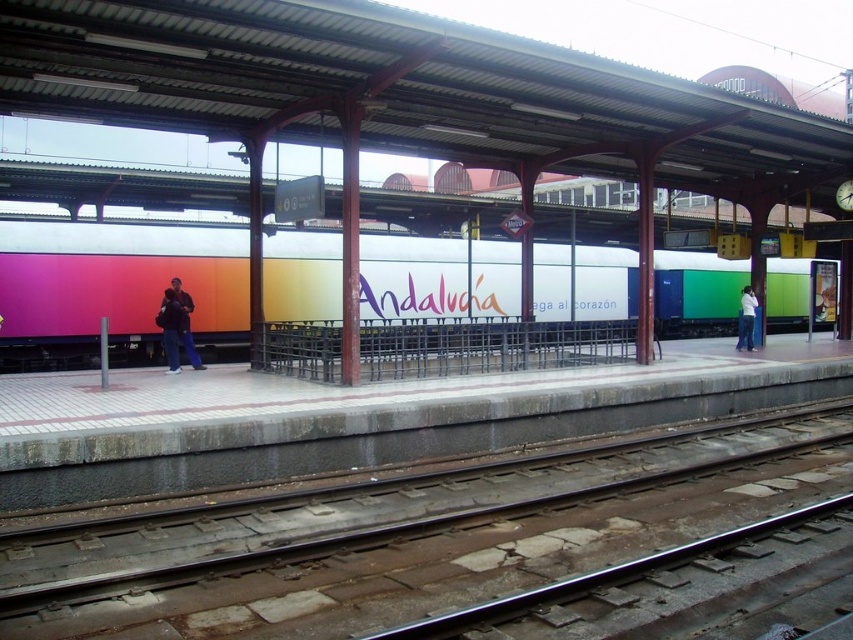
Can you confirm if concrete platform at center is positioned to the left of dark blue jeans at center?

Incorrect, concrete platform at center is not on the left side of dark blue jeans at center.

In the scene shown: Which of these two, concrete platform at center or dark blue jeans at center, stands taller?

dark blue jeans at center is taller.

Is point (750, 362) positioned behind point (172, 292)?

Yes, point (750, 362) is behind point (172, 292).

This screenshot has height=640, width=853. Find the location of `concrete platform at center`. concrete platform at center is located at coordinates (399, 404).

In the scene shown: Does metal at center have a lesser height compared to rainbow gradient billboard at center?

Correct, metal at center is not as tall as rainbow gradient billboard at center.

Who is shorter, metal at center or rainbow gradient billboard at center?

With less height is metal at center.

Measure the distance between metal at center and camera.

metal at center is 4.87 meters away from camera.

Locate an element on the screen. metal at center is located at coordinates (407, 538).

Is concrete platform at center behind jeans at right?

No, concrete platform at center is in front of jeans at right.

Which is below, concrete platform at center or jeans at right?

Positioned lower is concrete platform at center.

Locate an element on the screen. concrete platform at center is located at coordinates (399, 404).

Image resolution: width=853 pixels, height=640 pixels. I want to click on concrete platform at center, so click(399, 404).